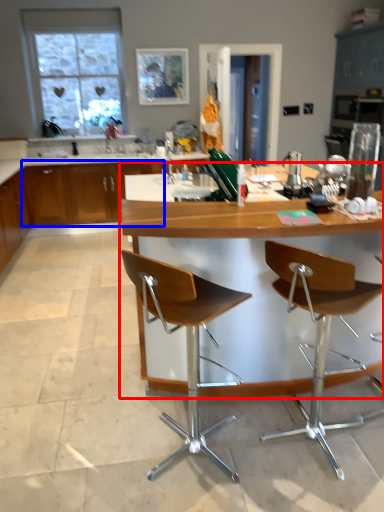
Question: Which point is closer to the camera, table (highlighted by a red box) or cabinetry (highlighted by a blue box)?

Choices:
 (A) table
 (B) cabinetry

Answer: (A)